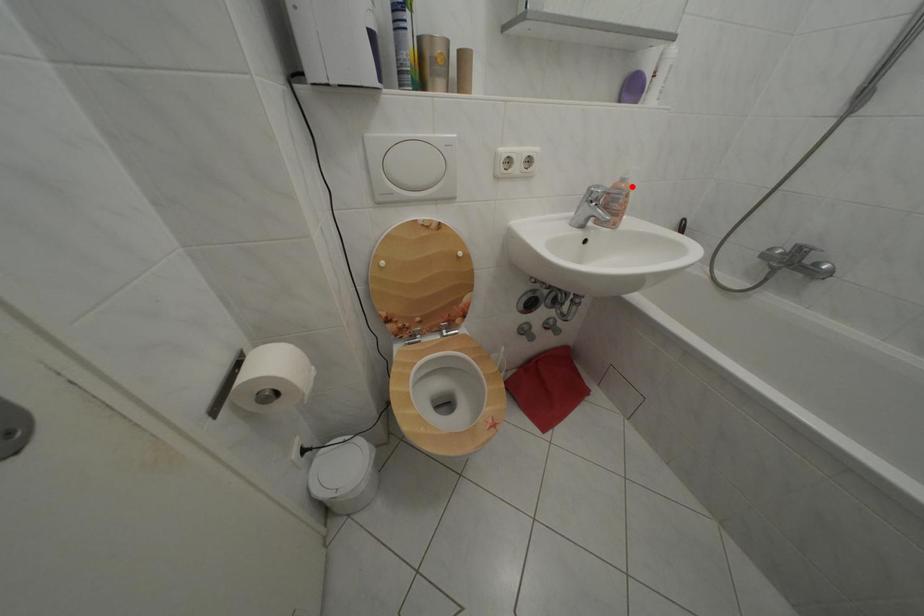
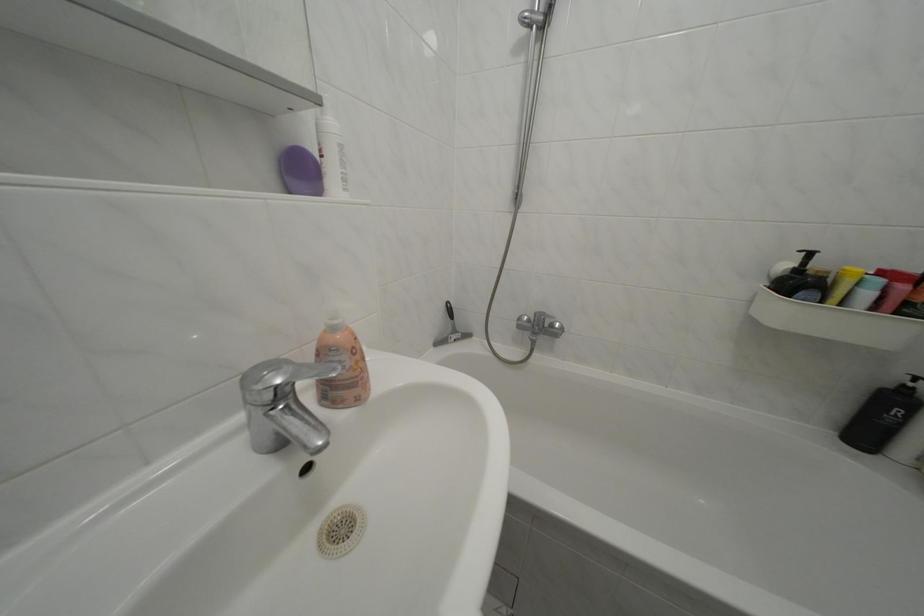
The point at the highlighted location is marked in the first image. Where is the corresponding point in the second image?

(342, 334)